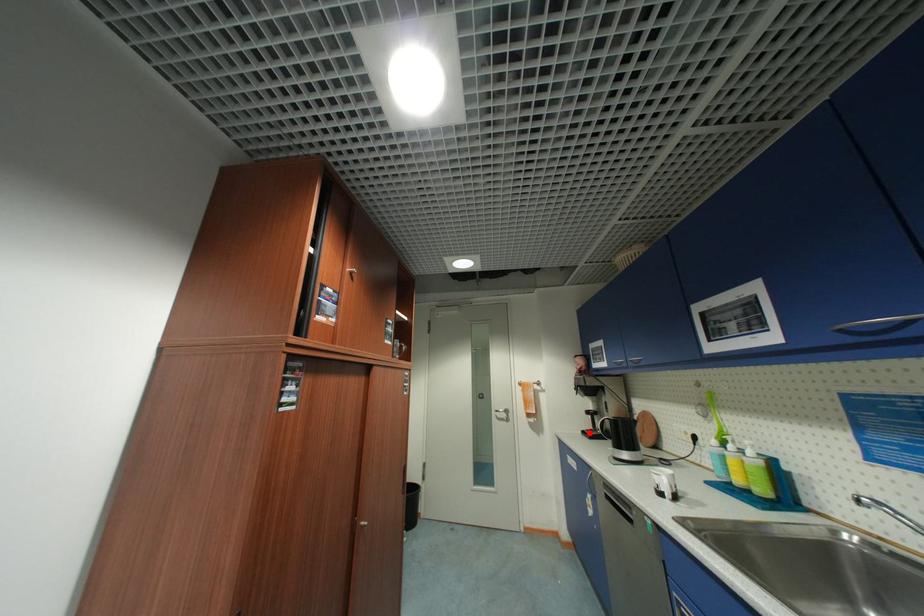
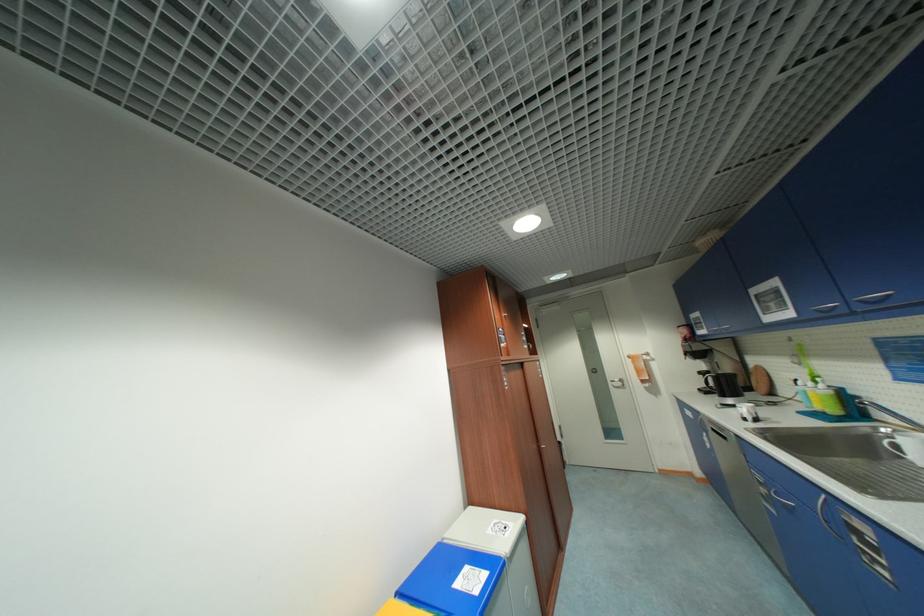
Find the pixel in the second image that matches the highlighted location in the first image.

(706, 391)